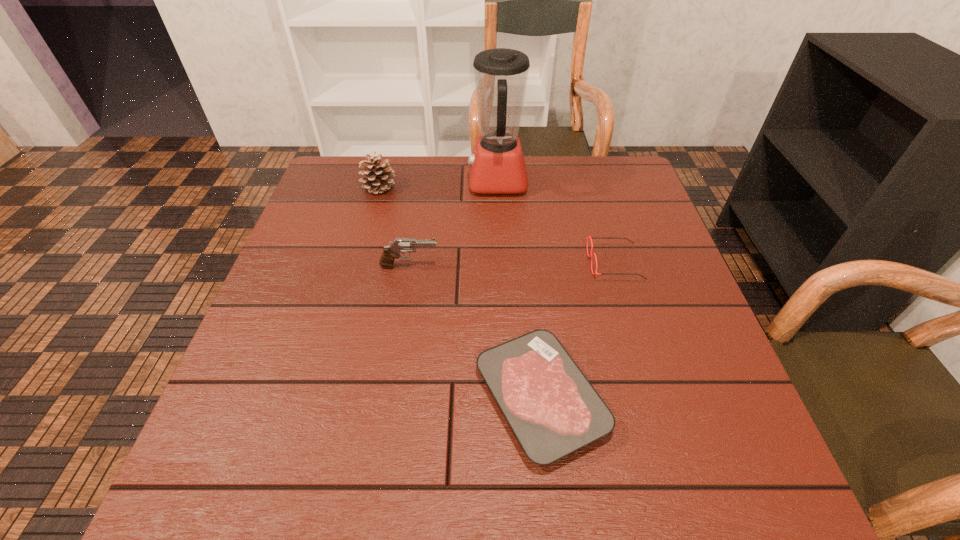
This screenshot has width=960, height=540. Identify the location of vacant space located on the front of the tallest object near the controls. (368, 182).

At what (x,y) coordinates should I click in order to perform the action: click on free space located on the front of the tallest object near the controls. Please return your answer as a coordinate pair (x, y). The width and height of the screenshot is (960, 540). Looking at the image, I should click on (388, 182).

This screenshot has height=540, width=960. Identify the location of free space located on the left of the leftmost object. click(x=344, y=187).

The height and width of the screenshot is (540, 960). Identify the location of vacant area situated at the barrel of the third shortest object. (476, 266).

Identify the location of vacant region located 0.160m on the front-facing side of the rightmost object. (521, 263).

This screenshot has height=540, width=960. I want to click on free spot located on the front-facing side of the rightmost object, so click(420, 263).

Where is `free location located 0.140m on the front-facing side of the rightmost object`? This screenshot has width=960, height=540. free location located 0.140m on the front-facing side of the rightmost object is located at coordinates (530, 263).

You are a GUI agent. You are given a task and a screenshot of the screen. Output one action in this format:
    pyautogui.click(x=<x>, y=<y>)
    Task: Click on the free space located 0.110m on the right of the shortest object
    
    Given the screenshot: What is the action you would take?
    pyautogui.click(x=666, y=398)

Identify the location of blender located in the far edge section of the desktop. (497, 166).

Locate an element on the screen. The width and height of the screenshot is (960, 540). pinecone at the far edge is located at coordinates (379, 175).